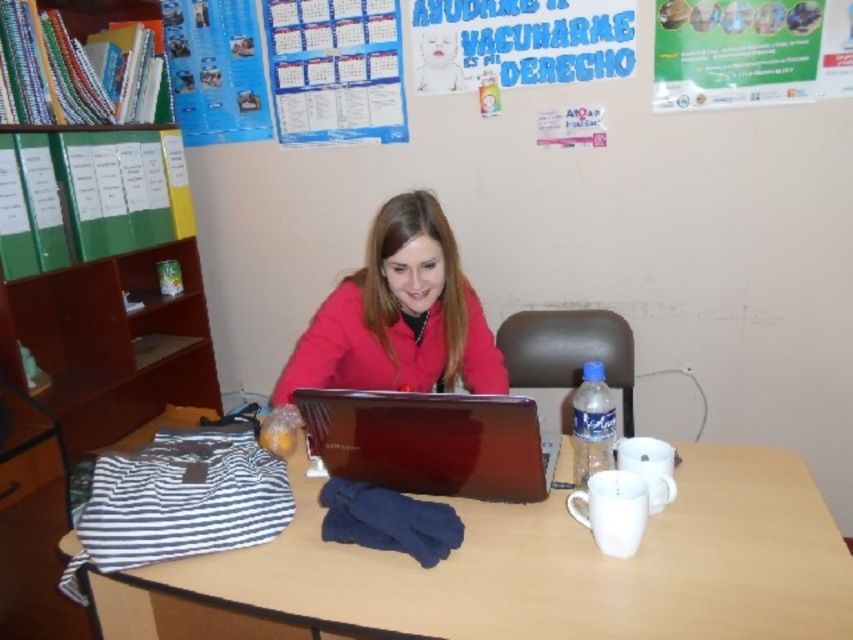
You are a tailor measuring fabrics for a new project. You have a piece of fabric that is exactly the same width as the matte green poster at upper right. Can you determine if this fabric is wide enough to make a new jacket similar to the matte red jacket at center without any adjustments?

The matte red jacket at center is wider than the matte green poster at upper right. Therefore, the fabric, which matches the poster width, is not wide enough to create a jacket of the same width as the matte red jacket at center without adjustments.

You are organizing a health fair and need to place a 3.5 feet wide banner between the matte green poster at upper right and the matte paper calendar at upper center. Will there be enough space?

The distance between the matte green poster at upper right and the matte paper calendar at upper center is 3.63 feet, so yes, the banner will fit as it is slightly narrower than the available space.

You are a visitor in this workspace and want to find the matte green poster at upper right. Where should you look relative to the matte red jacket at center?

The matte green poster at upper right is located above the matte red jacket at center.